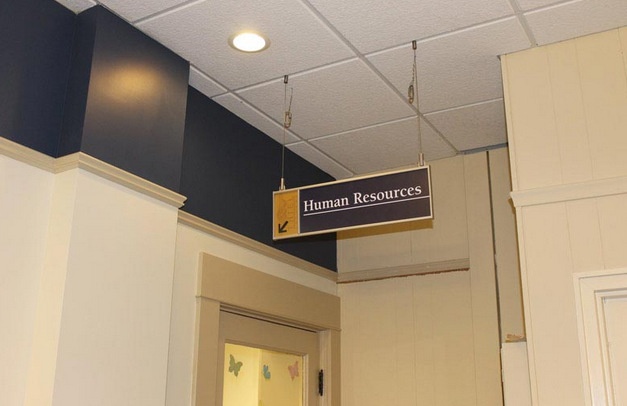
At what (x,y) coordinates should I click in order to perform the action: click on white trim. Please return your answer as a coordinate pair (x, y). Image resolution: width=627 pixels, height=406 pixels. Looking at the image, I should click on (601, 308), (589, 299), (579, 279), (525, 204), (524, 191), (155, 187), (154, 194).